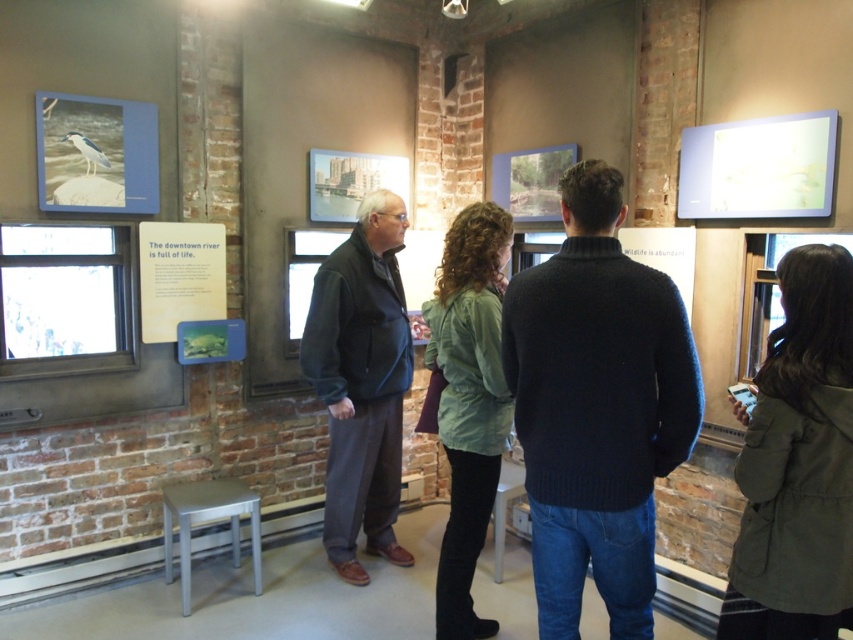
Consider the image. You are an event planner organizing a photo shoot in the museum. You need to position a large camera on a tripod between the dark blue jacket at center and the white matte poster at upper right. Since the camera requires at least 1.2 meters of space to operate, can you fit it there?

The dark blue jacket at center has a larger size compared to the white matte poster at upper right. However, the exact distance between them isn generated in the provided information. Therefore, it is impossible to determine if the camera can fit there based on the given data.

You are standing in the museum and need to locate the green matte jacket at lower right. According to the coordinates provided, where exactly should you look?

The green matte jacket at lower right is located at the 2D coordinates point (798, 464).